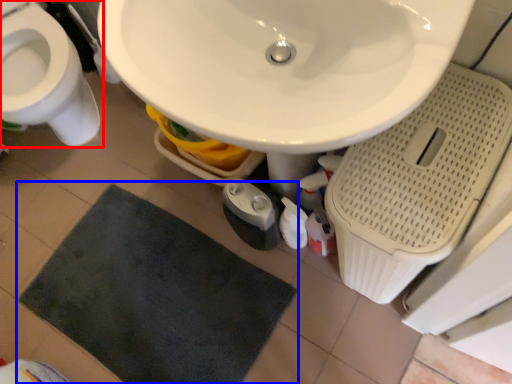
Question: Which object is closer to the camera taking this photo, toilet (highlighted by a red box) or bath mat (highlighted by a blue box)?

Choices:
 (A) toilet
 (B) bath mat

Answer: (A)